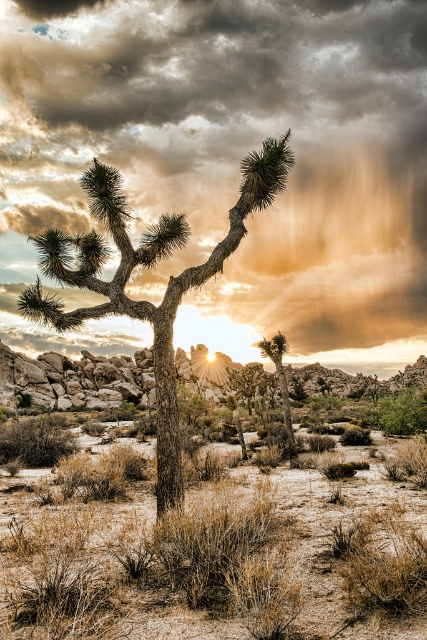
You are a photographer trying to capture the Joshua tree against the sunset backdrop. Since both the matte brown joshua tree at center and the green leafy tree at center are in the frame, which tree will appear closer to the camera in your photo?

The matte brown joshua tree at center appears closer to the camera because it is positioned in front of the green leafy tree at center.

You are an astronomer observing the desert landscape. You notice the cloudy sky at upper center and the matte brown joshua tree at center. Which object is positioned higher in the sky?

The cloudy sky at upper center is positioned higher in the sky than the matte brown joshua tree at center because it is located above it.